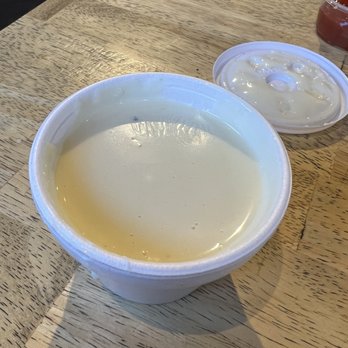
Find the location of a particular element. The height and width of the screenshot is (348, 348). liquid in cup is located at coordinates (155, 184).